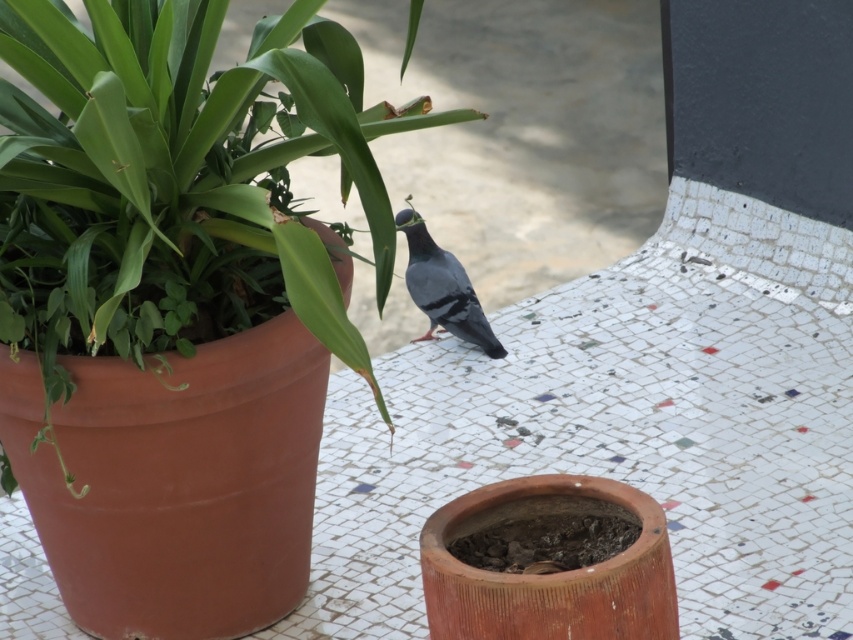
Who is shorter, green matte pot at center or gray matte pigeon at center?

gray matte pigeon at center is shorter.

Does green matte pot at center have a smaller size compared to gray matte pigeon at center?

No, green matte pot at center is not smaller than gray matte pigeon at center.

Which is in front, point (335, 118) or point (436, 250)?

Point (335, 118)

Where is `green matte pot at center`? This screenshot has width=853, height=640. green matte pot at center is located at coordinates 177,182.